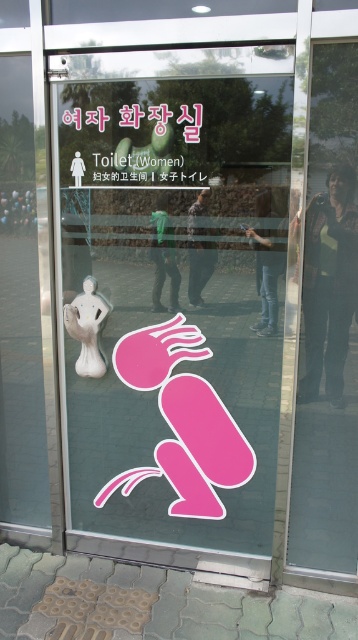
Is transparent glass door at right positioned in front of white glossy statue at center?

Yes.

Is transparent glass door at right to the right of white glossy statue at center from the viewer's perspective?

Yes, transparent glass door at right is to the right of white glossy statue at center.

Who is more forward, [298,557] or [66,320]?

Point [298,557]

Where is `transparent glass door at right`? transparent glass door at right is located at coordinates (327, 326).